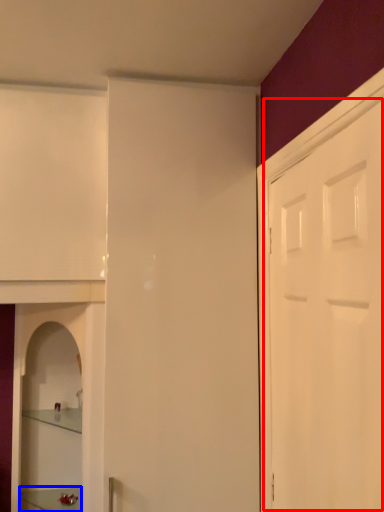
Question: Among these objects, which one is nearest to the camera, door (highlighted by a red box) or furniture (highlighted by a blue box)?

Choices:
 (A) door
 (B) furniture

Answer: (A)